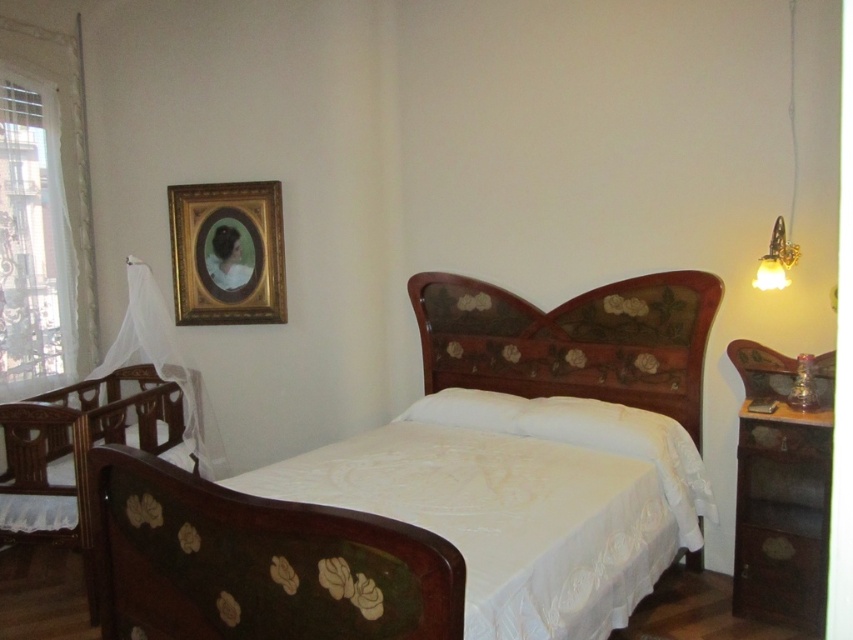
You are trying to decide whether to place a new decorative item on the wooden bed at center or the white soft pillow at center. Based on their sizes, which surface would be more suitable for placing a larger decorative item?

The wooden bed at center has a larger size compared to the white soft pillow at center, so it would be more suitable for placing a larger decorative item.

You are a parent preparing for a baby shower. You want to place a decorative wreath on the wall between the white sheer curtain at left and the wooden crib at left. However, you need to ensure that the wreath won

The white sheer curtain at left is thinner than the wooden crib at left, so the wreath can be placed between them as there is sufficient space.

You are standing in the vintage bedroom and want to determine which of the two points, point (804,522) or point (22,136), is closer to you. Based on the image, which point is nearer?

Point (804,522) is closer to the camera than point (22,136), so the point closer to you is point (804,522).